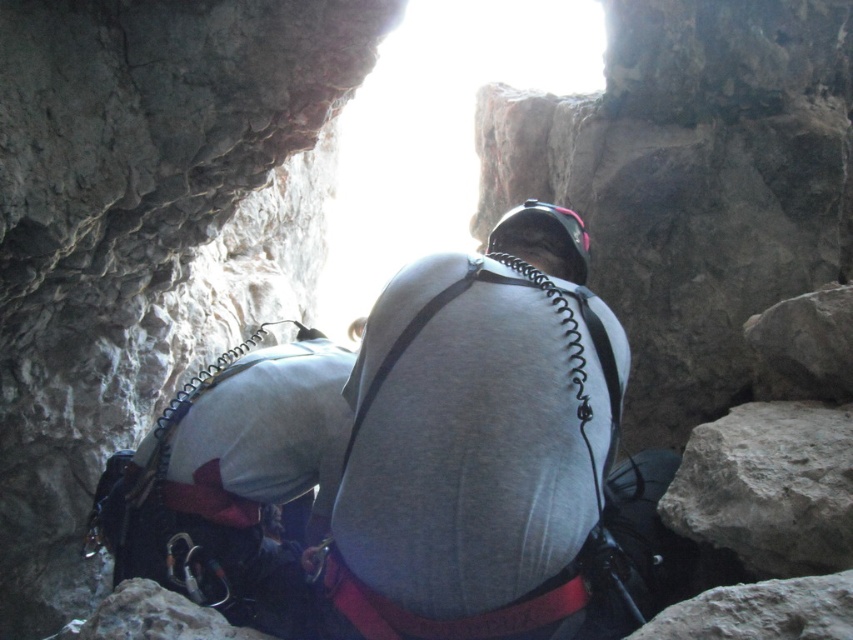
You are a safety inspector reviewing the climbing gear setup. You notice the gray matte shirt at center and the matte gray harness at center. According to safety protocols, which item should be visible and not covered by the other?

The gray matte shirt at center is positioned over the matte gray harness at center, so the harness should be visible and not covered by the shirt to ensure proper safety checks. Therefore, the harness should not be covered by the shirt.

You are a photographer trying to capture both the gray matte shirt at center and the gray rock at lower right in a single frame. Based on their sizes, which object should you focus on to ensure both are clearly visible in your photo?

The gray matte shirt at center is bigger than the gray rock at lower right. To ensure both are clearly visible, focus on the gray matte shirt at center since it is larger and will be easier to capture in detail while still allowing the smaller gray rock at lower right to be in the frame.

You are a photographer trying to capture the best shot of the two points in the image. Which point, point (612, 337) or point (271, 358), will appear larger in your photo?

Point (612, 337) will appear larger in the photo because it is closer to the camera than point (271, 358).